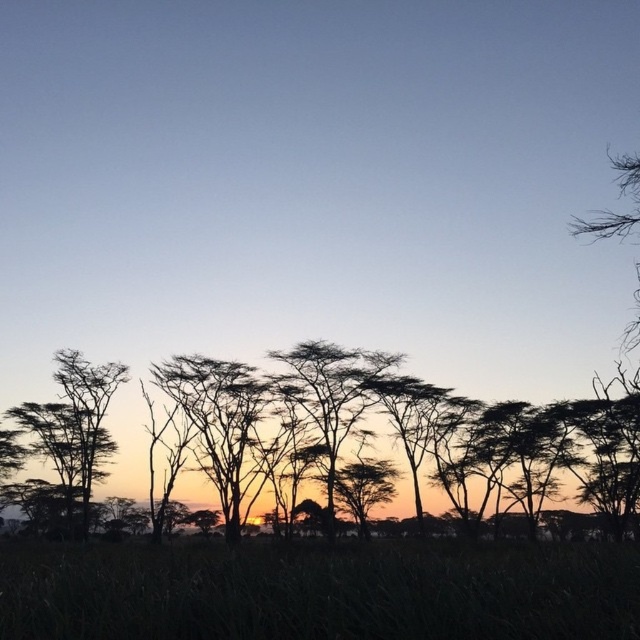
Question: Is green grass at lower center behind silhouette tree at center?

Choices:
 (A) yes
 (B) no

Answer: (B)

Question: Which object appears closest to the camera in this image?

Choices:
 (A) silhouette tree at center
 (B) green grass at lower center

Answer: (B)

Question: Does green grass at lower center lie behind silhouette tree at center?

Choices:
 (A) yes
 (B) no

Answer: (B)

Question: Which object is farther from the camera taking this photo?

Choices:
 (A) silhouette tree at center
 (B) green grass at lower center

Answer: (A)

Question: Which point is closer to the camera taking this photo?

Choices:
 (A) (426, 636)
 (B) (536, 440)

Answer: (A)

Question: Is green grass at lower center thinner than silhouette tree at center?

Choices:
 (A) yes
 (B) no

Answer: (A)